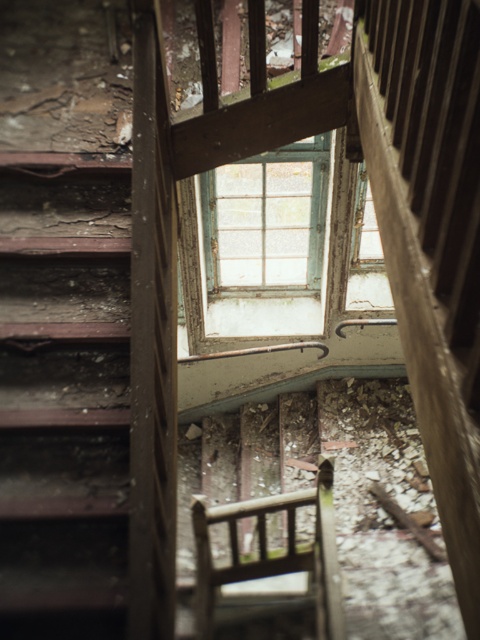
You are standing at the top of the staircase in this abandoned building and see the green weathered wood window at center. If you want to reach the window, in which direction should you move relative to the staircase?

The green weathered wood window at center is located at point 0.341 on the x axis and 0.556 on the y axis. Since the staircase leads downward towards the window, you should move downward along the staircase to reach it.

You are a maintenance worker assessing the safety of the rusty metal stairs at left and the wooden chair at center in an abandoned building. Which object is smaller in size?

The rusty metal stairs at left is smaller than the wooden chair at center according to the description.

You are standing at the top of the stairs in this abandoned building and see the rusty metal stairs at left and the wooden chair at center. Which object is nearer to you?

The rusty metal stairs at left are closer to the viewer than the wooden chair at center, so the rusty metal stairs at left is nearer to you.